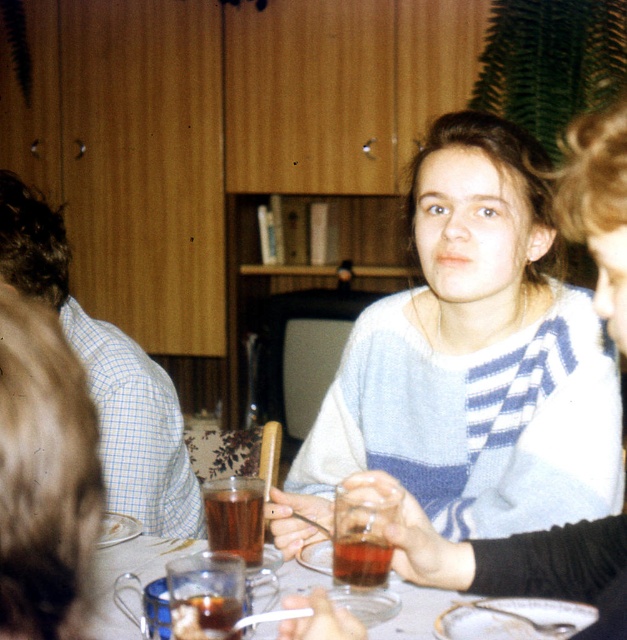
You are at a dinner table and see a translucent glass tea cup at center and a brown liquid at center. Which object is located to the right of the other?

The translucent glass tea cup at center is positioned on the right side of brown liquid at center.

You are a photographer trying to capture a closeup of the blue checkered shirt at left and the translucent glass tea cup at center. Since you want to focus on both objects equally, which one should you adjust the camera focus on first?

The blue checkered shirt at left has a lesser width compared to the translucent glass tea cup at center, so you should focus on the translucent glass tea cup at center first because it is larger and will require more precise focusing to ensure both are in focus.

You are a photographer trying to capture a closeup of the translucent glass tea cup at center without including the blue checkered shirt at left in the frame. Based on their positions, is this possible?

The blue checkered shirt at left is located above the translucent glass tea cup at center, so lowering the camera angle might allow you to exclude the shirt while focusing on the cup.